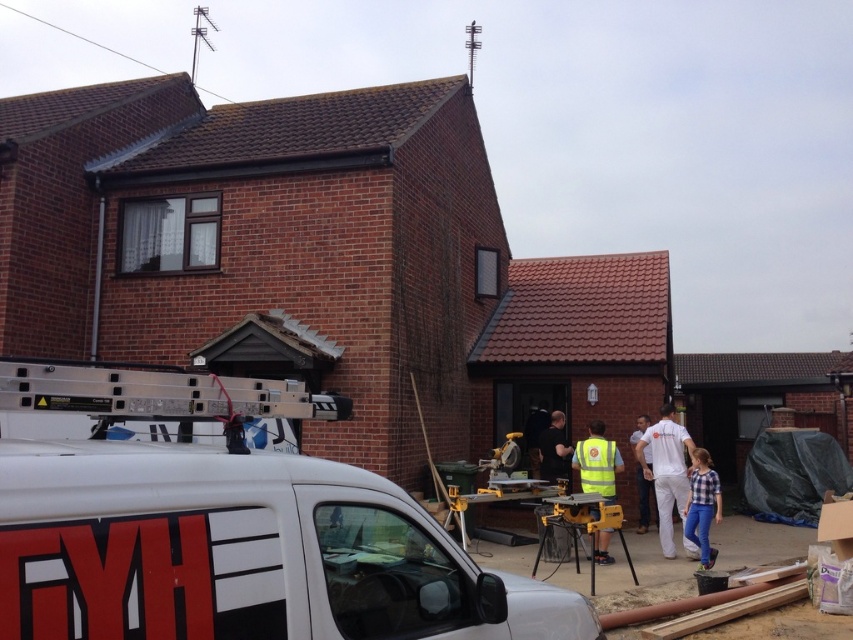
You are a construction worker who needs to locate your tools. You remember leaving them near the reflective yellow vest at center and the plaid shirt at lower right. Based on the scene, which object is closer to the edge of the frame?

The plaid shirt at lower right is closer to the edge of the frame since it is positioned to the right of the reflective yellow vest at center, and the van is parked near the edge of the frame.

You are a delivery person trying to unload a package from the white matte van at center. You notice a white cotton shirt at center nearby. Can you determine if the van is shorter than the shirt?

The white matte van at center is not as tall as white cotton shirt at center, so yes, the van is shorter than the shirt.

You are a delivery person needing to place a heavy box on the ground near the white matte van at center. The reflective yellow vest at center must remain visible to ensure safety. Can you safely place the box 7 meters away from the van without blocking the vest?

The distance between the white matte van at center and the reflective yellow vest at center is 7.40 meters. Placing the box 7 meters away from the van would leave 0.40 meters between the box and the vest, which is insufficient to keep the vest visible. Choose a closer spot to the van to maintain visibility of the reflective yellow vest at center.